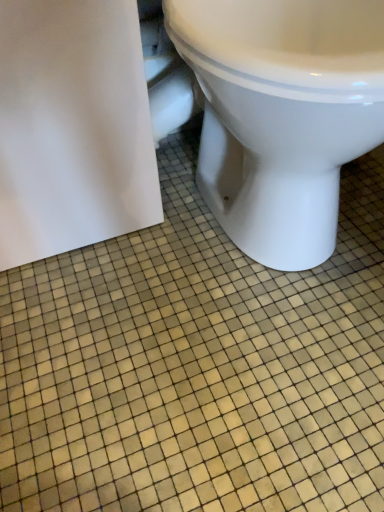
Find the location of a particular element. The image size is (384, 512). white glossy toilet at center is located at coordinates (282, 114).

The image size is (384, 512). Describe the element at coordinates (282, 114) in the screenshot. I see `white glossy toilet at center` at that location.

You are a GUI agent. You are given a task and a screenshot of the screen. Output one action in this format:
    pyautogui.click(x=<x>, y=<y>)
    Task: Click on the white glossy toilet at center
    This screenshot has width=384, height=512.
    Given the screenshot: What is the action you would take?
    pyautogui.click(x=282, y=114)